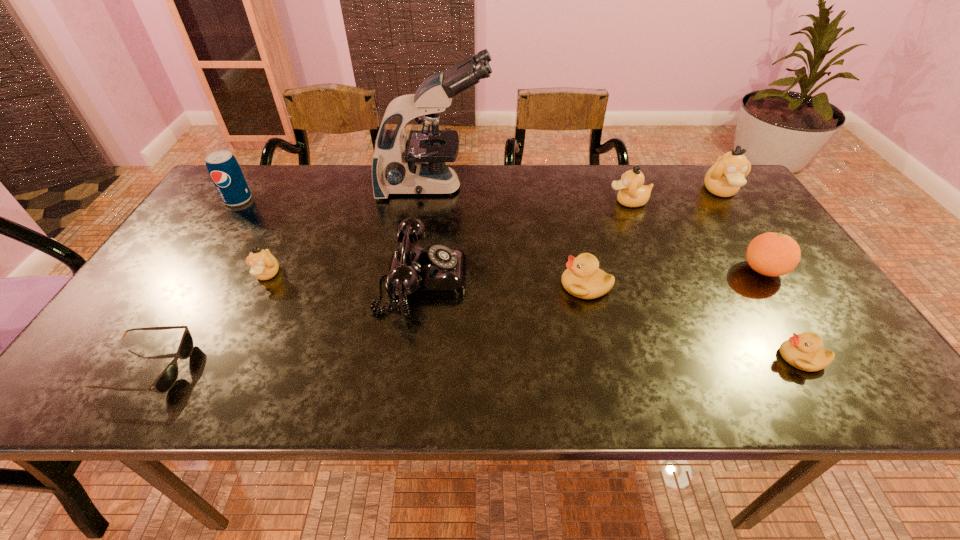
Find the location of a particular element. The height and width of the screenshot is (540, 960). free spot located 0.200m on the face of the second biggest tan duckling is located at coordinates (540, 202).

Identify the location of vacant space located 0.280m on the face of the second biggest tan duckling. [x=513, y=202].

Find the location of `vacant space located on the left of the orange`. vacant space located on the left of the orange is located at coordinates (688, 270).

You are a GUI agent. You are given a task and a screenshot of the screen. Output one action in this format:
    pyautogui.click(x=<x>, y=<y>)
    Task: Click on the vacant space located on the front-facing side of the bigger yellow duckling
    This screenshot has height=540, width=960.
    Given the screenshot: What is the action you would take?
    pyautogui.click(x=507, y=286)

In order to click on vacant space located on the front-facing side of the bigger yellow duckling in this screenshot , I will do `click(432, 286)`.

This screenshot has width=960, height=540. In order to click on free region located 0.280m on the front-facing side of the bigger yellow duckling in this screenshot , I will do `click(444, 286)`.

Identify the location of vacant area situated 0.100m on the face of the leftmost tan duckling. (245, 320).

Locate an element on the screen. Image resolution: width=960 pixels, height=540 pixels. free space located 0.400m on the front-facing side of the nearer yellow duckling is located at coordinates (588, 357).

This screenshot has width=960, height=540. I want to click on free spot located on the front-facing side of the nearer yellow duckling, so click(x=737, y=357).

The height and width of the screenshot is (540, 960). What are the coordinates of `free space located 0.150m on the front-facing side of the nearer yellow duckling` in the screenshot? It's located at (708, 357).